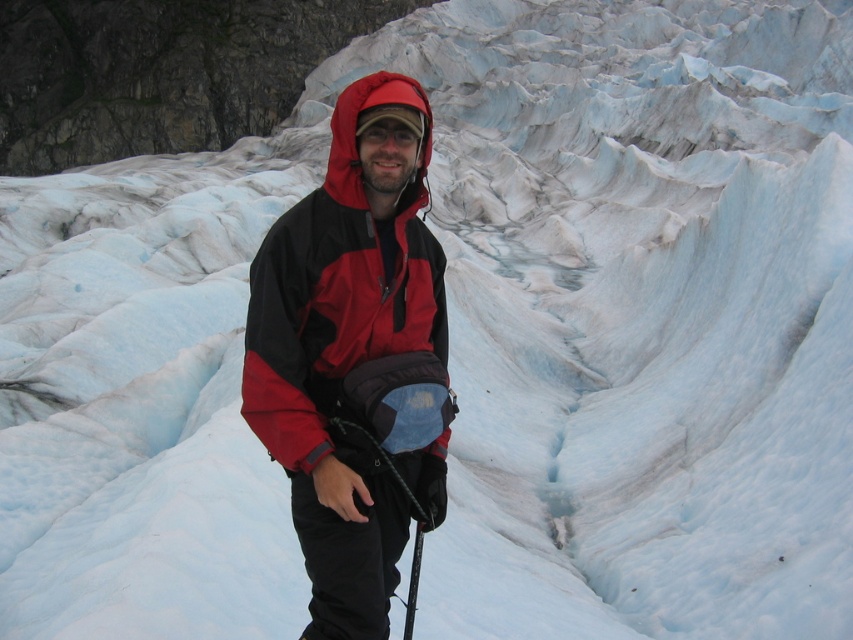
You are planning to take a photo of the red matte jacket at center and the black rubber ski pole at lower center. If your camera has a maximum focus range of 10 feet, will you be able to capture both objects in focus at the same time?

The red matte jacket at center and the black rubber ski pole at lower center are 12.22 feet apart, which exceeds the camera maximum focus range of 10 feet. Therefore, you cannot capture both objects in focus simultaneously.

You are a photographer positioned at a safe distance from the glacier. You want to capture a clear photo of the red matte jacket at center without any obstructions. Considering the distance, can you estimate whether the jacket is within the focus range of a standard camera lens set at 50mm with an aperture of f8?

The red matte jacket at center is 38.53 feet away. A standard 50mm lens at f8 has a hyperfocal distance of approximately 22 feet, meaning objects from 11 feet to infinity are in focus. Since 38.53 feet is within this range, the jacket should be in focus.